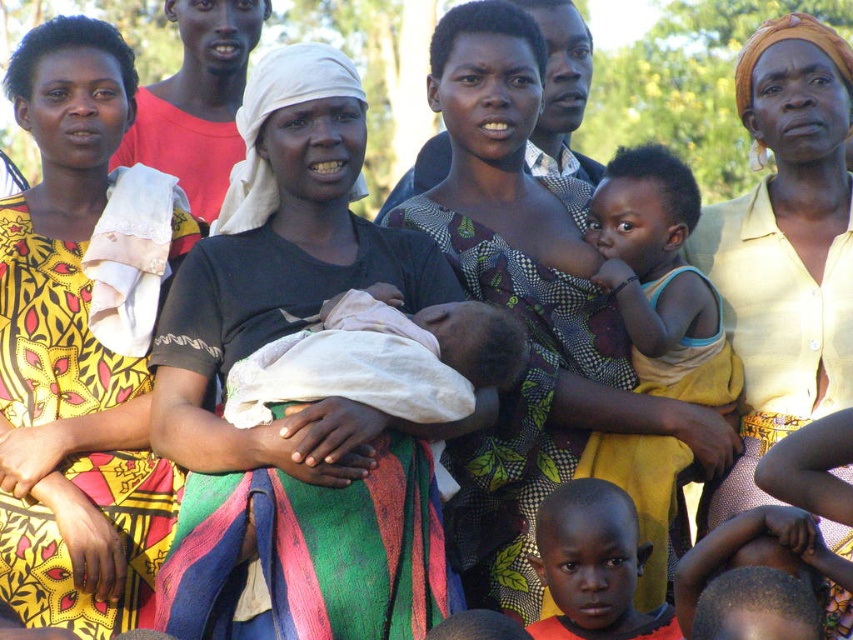
You are organizing a cultural exhibition and need to display two items from the image. The yellow printed fabric at left and the light blue cotton shirt at center must be displayed side by side. Which item requires a larger display space due to its size?

The yellow printed fabric at left requires a larger display space because it is bigger than the light blue cotton shirt at center according to the description.

In the scene shown: What is the spatial relationship between the yellow printed fabric at left and the green scarf at right in the scene?

The yellow printed fabric at left is positioned to the left of the green scarf at right.